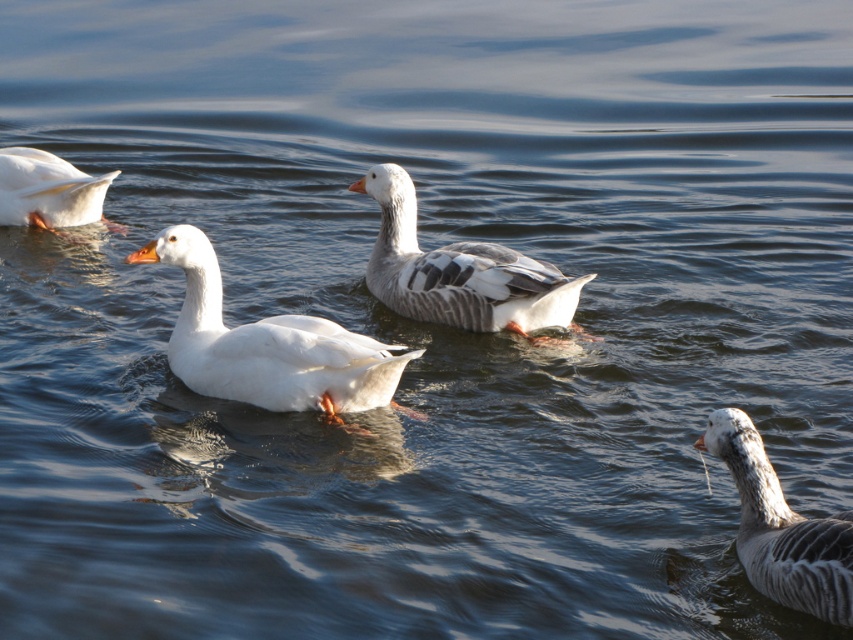
Consider the image. You are a photographer trying to capture a photo of the gray speckled duck at lower right and the white matte duck at left. Since you want both ducks to be clearly visible in the photo, which duck should you focus on first to ensure the other remains in focus?

The gray speckled duck at lower right is in front of the white matte duck at left, so you should focus on the gray speckled duck at lower right first to ensure the white matte duck at left stays in focus.

You are a photographer trying to capture a clear shot of the gray speckled duck at center and the white matte duck at left. Based on their positions, which duck is closer to the camera?

The gray speckled duck at center is closer to the camera because it is in front of the white matte duck at left.

You are a birdwatcher observing the scene. You notice the gray speckled duck at center and the white matte duck at left. Which duck is taller?

The gray speckled duck at center is much taller than the white matte duck at left.